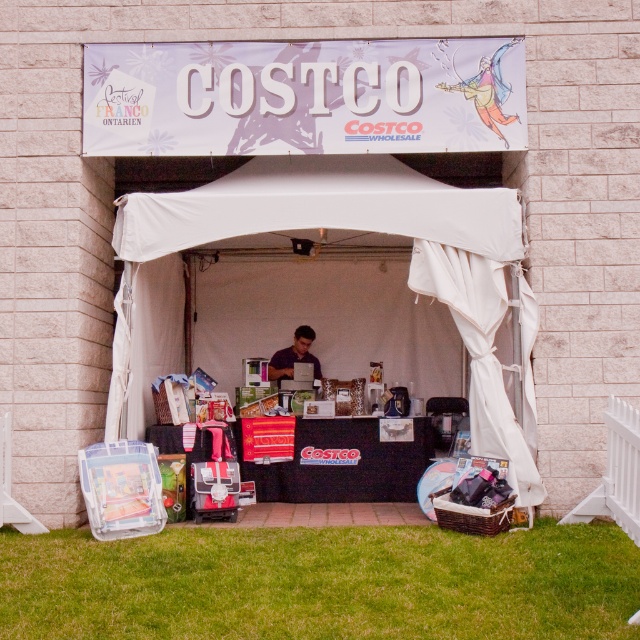
Question: Which object appears farthest from the camera in this image?

Choices:
 (A) matte black laptop at center
 (B) white fabric tent at center
 (C) green grass at lower center

Answer: (A)

Question: Considering the relative positions of green grass at lower center and white fabric tent at center in the image provided, where is green grass at lower center located with respect to white fabric tent at center?

Choices:
 (A) below
 (B) above

Answer: (A)

Question: Can you confirm if green grass at lower center is positioned to the right of white fabric tent at center?

Choices:
 (A) yes
 (B) no

Answer: (B)

Question: Which object is the closest to the white fabric tent at center?

Choices:
 (A) matte black laptop at center
 (B) green grass at lower center

Answer: (B)

Question: Which of the following is the closest to the observer?

Choices:
 (A) white fabric tent at center
 (B) green grass at lower center

Answer: (B)

Question: Is green grass at lower center bigger than white fabric tent at center?

Choices:
 (A) yes
 (B) no

Answer: (B)